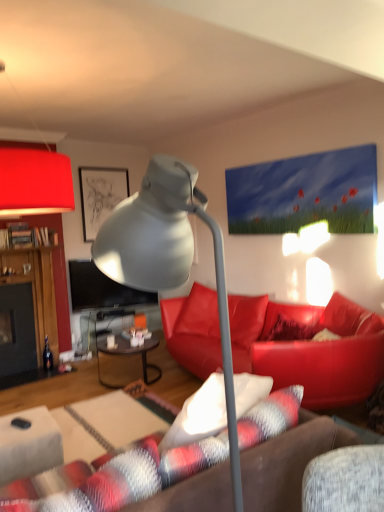
Question: In the image, is black glass table at center, acting as the first table starting from the back, on the left side or the right side of matte black picture frame at upper left?

Choices:
 (A) left
 (B) right

Answer: (B)

Question: Considering the positions of black glass table at center, acting as the first table starting from the back, and matte black picture frame at upper left in the image, is black glass table at center, acting as the first table starting from the back, wider or thinner than matte black picture frame at upper left?

Choices:
 (A) thin
 (B) wide

Answer: (B)

Question: Which object is the farthest from the black rubberized corded phone at lower left?

Choices:
 (A) matte black picture frame at upper left
 (B) matte red lampshade at upper left, marked as the 1th lamp in a left-to-right arrangement
 (C) matte gray lamp at center, acting as the 1th lamp starting from the right
 (D) white fabric table at lower left, which is the first table in front-to-back order
 (E) leather couch at center

Answer: (A)

Question: Which of these objects is positioned farthest from the black rubberized corded phone at lower left?

Choices:
 (A) leather couch at center
 (B) black glass table at center, the 2th table from the front
 (C) matte black picture frame at upper left
 (D) white fabric table at lower left, which is the first table in front-to-back order
 (E) matte red lampshade at upper left, the 1th lamp viewed from the top

Answer: (C)